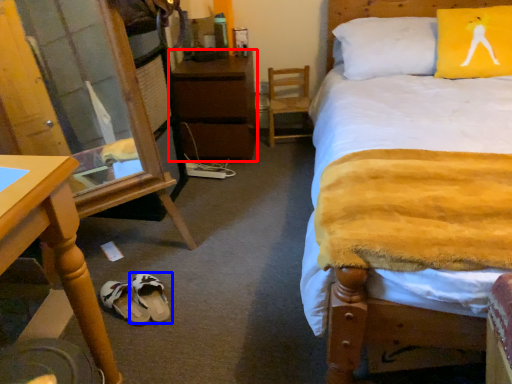
Question: Which object appears closest to the camera in this image, nightstand (highlighted by a red box) or footwear (highlighted by a blue box)?

Choices:
 (A) nightstand
 (B) footwear

Answer: (B)